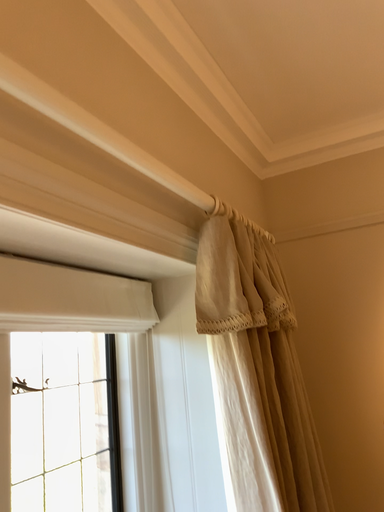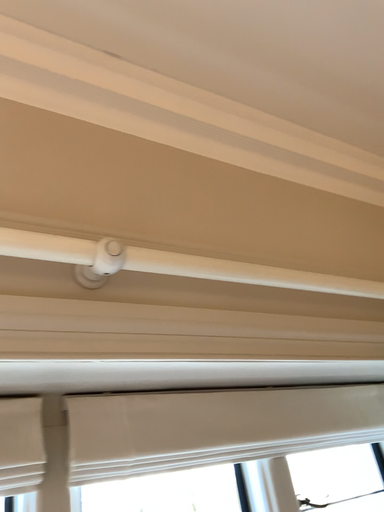
Question: How did the camera likely rotate when shooting the video?

Choices:
 (A) rotated downward
 (B) rotated upward

Answer: (B)